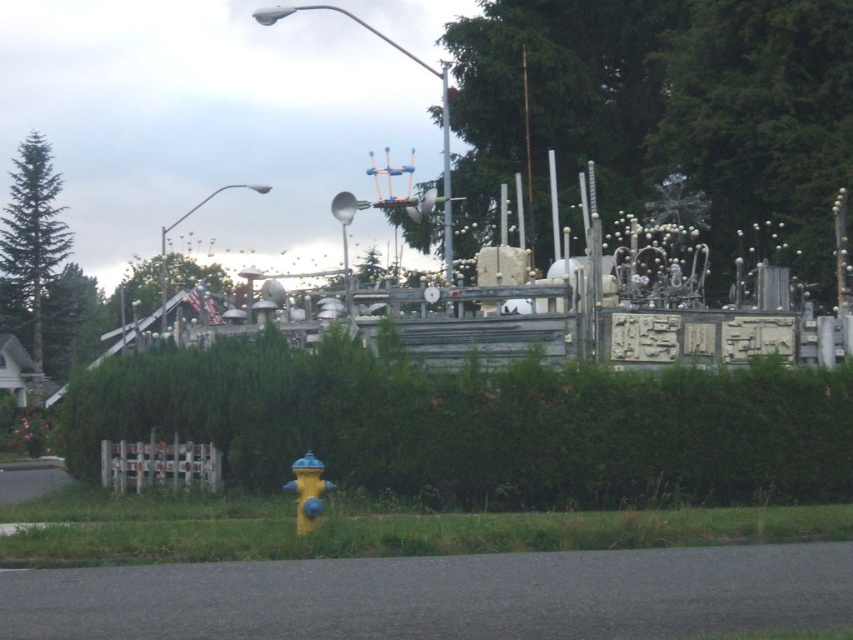
Based on the photo, can you confirm if green leafy hedge at center is positioned to the right of metallic pole at upper center?

In fact, green leafy hedge at center is to the left of metallic pole at upper center.

Does green leafy hedge at center have a lesser width compared to metallic pole at upper center?

In fact, green leafy hedge at center might be wider than metallic pole at upper center.

Is point (467, 481) positioned behind point (445, 262)?

No, (467, 481) is closer to viewer.

You are a GUI agent. You are given a task and a screenshot of the screen. Output one action in this format:
    pyautogui.click(x=<x>, y=<y>)
    Task: Click on the green leafy hedge at center
    
    Given the screenshot: What is the action you would take?
    pyautogui.click(x=479, y=426)

Is green textured sculpture at center to the left of green matte tree at upper center from the viewer's perspective?

No, green textured sculpture at center is not to the left of green matte tree at upper center.

Which of these two, green textured sculpture at center or green matte tree at upper center, stands shorter?

green matte tree at upper center

The height and width of the screenshot is (640, 853). What are the coordinates of `green textured sculpture at center` in the screenshot? It's located at pos(666,108).

Where is `green textured sculpture at center`? green textured sculpture at center is located at coordinates (666, 108).

Is point (582, 84) closer to viewer compared to point (57, 380)?

Yes, it is in front of point (57, 380).

Between green textured sculpture at center and green matte tree at upper left, which one is positioned higher?

Positioned higher is green textured sculpture at center.

This screenshot has width=853, height=640. What do you see at coordinates (666, 108) in the screenshot? I see `green textured sculpture at center` at bounding box center [666, 108].

You are a GUI agent. You are given a task and a screenshot of the screen. Output one action in this format:
    pyautogui.click(x=<x>, y=<y>)
    Task: Click on the green textured sculpture at center
    
    Given the screenshot: What is the action you would take?
    pyautogui.click(x=666, y=108)